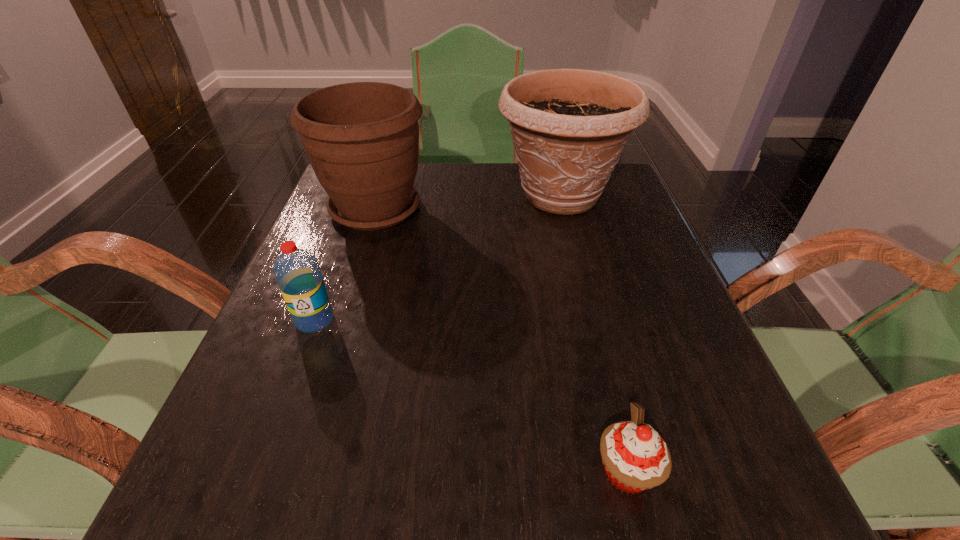
At what (x,y) coordinates should I click in order to perform the action: click on free space in the image that satisfies the following two spatial constraints: 1. on the back side of the left flowerpot; 2. on the left side of the right flowerpot. Please return your answer as a coordinate pair (x, y). Looking at the image, I should click on (380, 195).

Where is `free space that satisfies the following two spatial constraints: 1. on the back side of the nearest object; 2. on the right side of the right flowerpot`? free space that satisfies the following two spatial constraints: 1. on the back side of the nearest object; 2. on the right side of the right flowerpot is located at coordinates (558, 195).